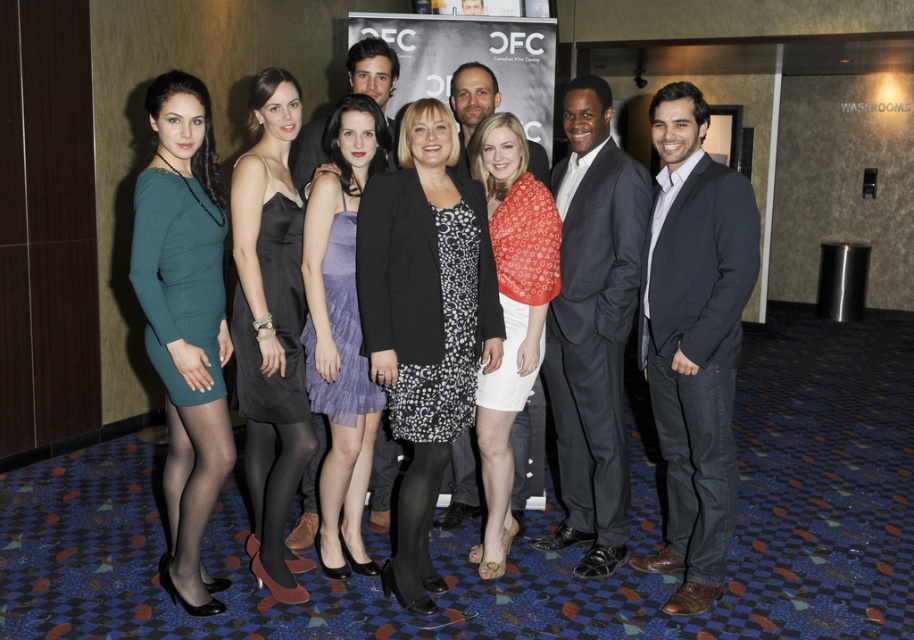
In the scene shown: Who is shorter, dark gray suit at center or dark gray pinstripe suit at center?

dark gray suit at center is shorter.

Is dark gray suit at center positioned behind dark gray pinstripe suit at center?

That is False.

What do you see at coordinates (694, 340) in the screenshot?
I see `dark gray suit at center` at bounding box center [694, 340].

You are a GUI agent. You are given a task and a screenshot of the screen. Output one action in this format:
    pyautogui.click(x=<x>, y=<y>)
    Task: Click on the dark gray suit at center
    The height and width of the screenshot is (640, 914).
    Given the screenshot: What is the action you would take?
    694,340

How far apart are black textured blazer at center and satin black dress at center?

The distance of black textured blazer at center from satin black dress at center is 48.71 centimeters.

The image size is (914, 640). Describe the element at coordinates (424, 323) in the screenshot. I see `black textured blazer at center` at that location.

At what (x,y) coordinates should I click in order to perform the action: click on black textured blazer at center. Please return your answer as a coordinate pair (x, y). Image resolution: width=914 pixels, height=640 pixels. Looking at the image, I should click on [424, 323].

Which is in front, point (397, 244) or point (178, 516)?

Point (397, 244)

You are a GUI agent. You are given a task and a screenshot of the screen. Output one action in this format:
    pyautogui.click(x=<x>, y=<y>)
    Task: Click on the black textured blazer at center
    
    Given the screenshot: What is the action you would take?
    pyautogui.click(x=424, y=323)

You are a GUI agent. You are given a task and a screenshot of the screen. Output one action in this format:
    pyautogui.click(x=<x>, y=<y>)
    Task: Click on the black textured blazer at center
    The image size is (914, 640).
    Given the screenshot: What is the action you would take?
    tap(424, 323)